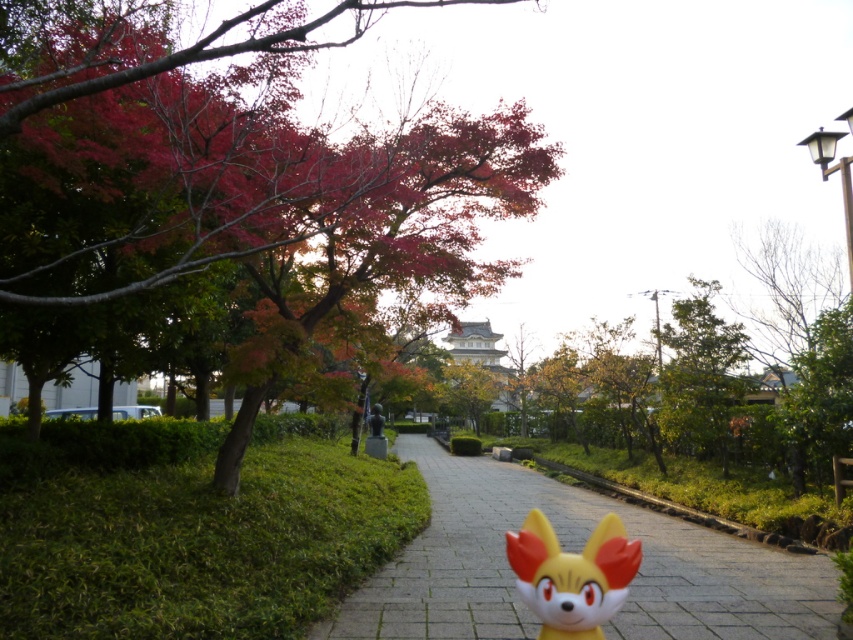
Question: Where is reddish-brown bark tree at upper left located in relation to paved stone path at center in the image?

Choices:
 (A) right
 (B) left

Answer: (B)

Question: Can you confirm if reddish-brown bark tree at upper left is bigger than paved stone path at center?

Choices:
 (A) yes
 (B) no

Answer: (A)

Question: Which object is the closest to the reddish-brown bark tree at upper left?

Choices:
 (A) paved stone path at center
 (B) plastic fox head at center
 (C) green leafy tree at upper right

Answer: (A)

Question: Is paved stone path at center further to camera compared to plastic fox head at center?

Choices:
 (A) yes
 (B) no

Answer: (A)

Question: Estimate the real-world distances between objects in this image. Which object is closer to the green leafy tree at upper right?

Choices:
 (A) reddish-brown bark tree at upper left
 (B) plastic fox head at center

Answer: (A)

Question: Which point is farther from the camera taking this photo?

Choices:
 (A) (720, 412)
 (B) (444, 502)
 (C) (57, 38)
 (D) (585, 593)

Answer: (A)